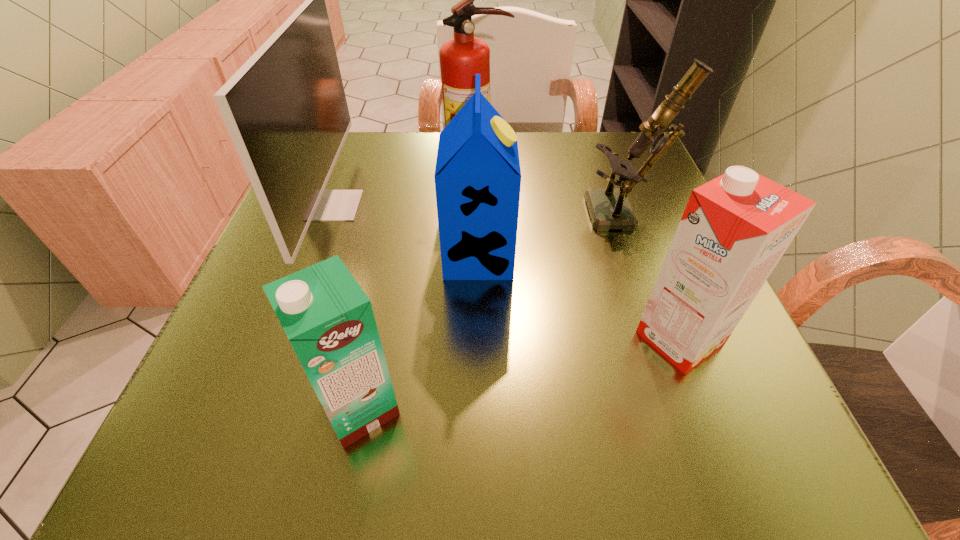
Locate an element on the screen. Image resolution: width=960 pixels, height=540 pixels. vacant area located 0.240m at the eyepiece of the microscope is located at coordinates (466, 215).

This screenshot has height=540, width=960. In order to click on free space located at the eyepiece of the microscope in this screenshot , I will do `click(553, 215)`.

Where is `free space located on the back of the rightmost carton`? The width and height of the screenshot is (960, 540). free space located on the back of the rightmost carton is located at coordinates (x=647, y=254).

Where is `vacant space located on the left of the leftmost carton`? vacant space located on the left of the leftmost carton is located at coordinates point(204,407).

In order to click on fire extinguisher that is positioned at the far edge in this screenshot , I will do `click(461, 58)`.

This screenshot has height=540, width=960. Identify the location of monitor situated at the far edge. (286, 111).

You are a GUI agent. You are given a task and a screenshot of the screen. Output one action in this format:
    pyautogui.click(x=<x>, y=<y>)
    Task: Click on the object positioned at the near edge
    This screenshot has width=960, height=540.
    Given the screenshot: What is the action you would take?
    pyautogui.click(x=327, y=317)

The height and width of the screenshot is (540, 960). In order to click on object present at the left edge in this screenshot , I will do [286, 111].

Locate an element on the screen. microscope that is at the right edge is located at coordinates (610, 208).

This screenshot has height=540, width=960. Find the location of `carton that is positioned at the right edge`. carton that is positioned at the right edge is located at coordinates pos(735,228).